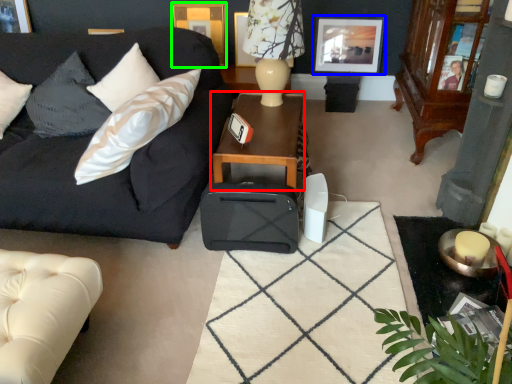
Question: Which object is the closest to the table (highlighted by a red box)? Choose among these: picture frame (highlighted by a blue box) or picture frame (highlighted by a green box).

Choices:
 (A) picture frame
 (B) picture frame

Answer: (A)